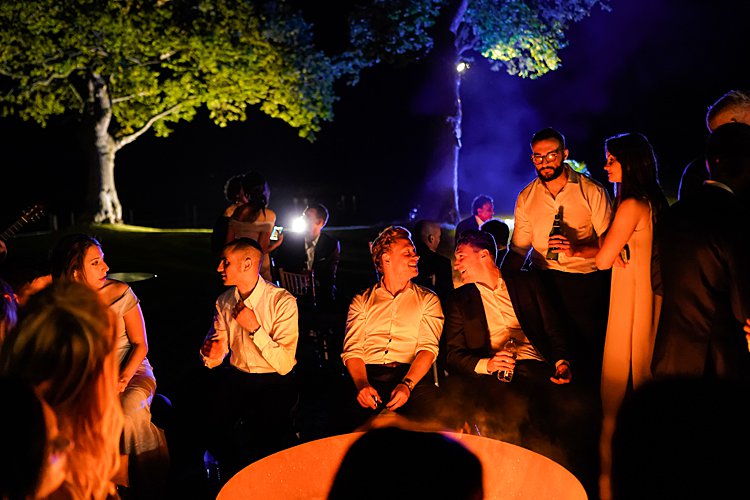
This screenshot has width=750, height=500. Identify the location of light. (464, 72).